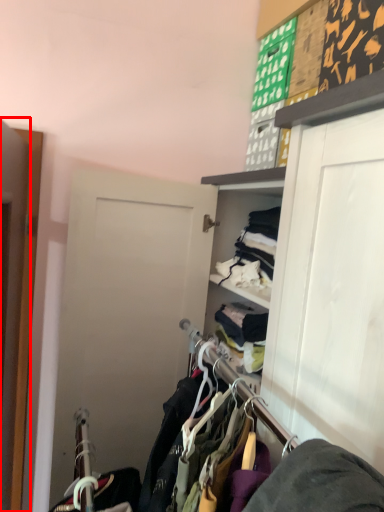
Question: In this image, where is door (annotated by the red box) located relative to closet?

Choices:
 (A) right
 (B) left

Answer: (B)